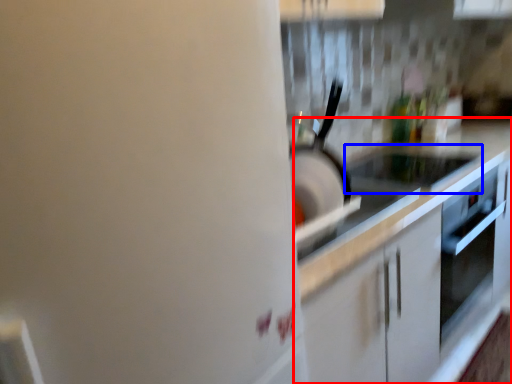
Question: Which object is closer to the camera taking this photo, countertop (highlighted by a red box) or appliance (highlighted by a blue box)?

Choices:
 (A) countertop
 (B) appliance

Answer: (A)